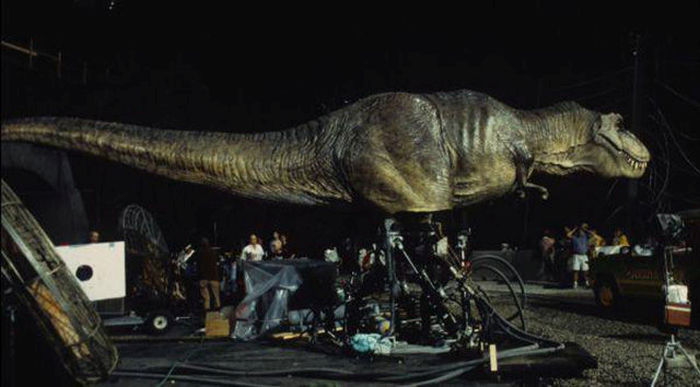
Locate an element on the screen. This screenshot has height=387, width=700. shade is located at coordinates (113, 259).